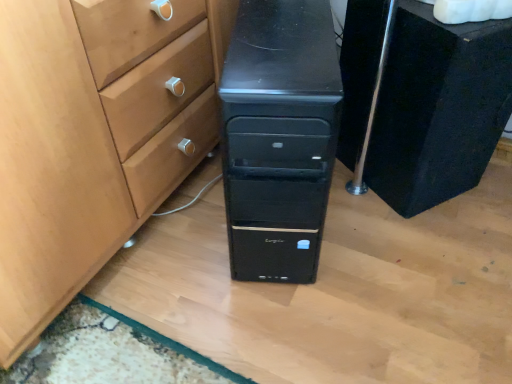
Locate an element on the screen. This screenshot has width=512, height=384. vacant space positioned to the left of black matte chest of drawers at center, which appears as the second chest of drawers when viewed from the right is located at coordinates (175, 233).